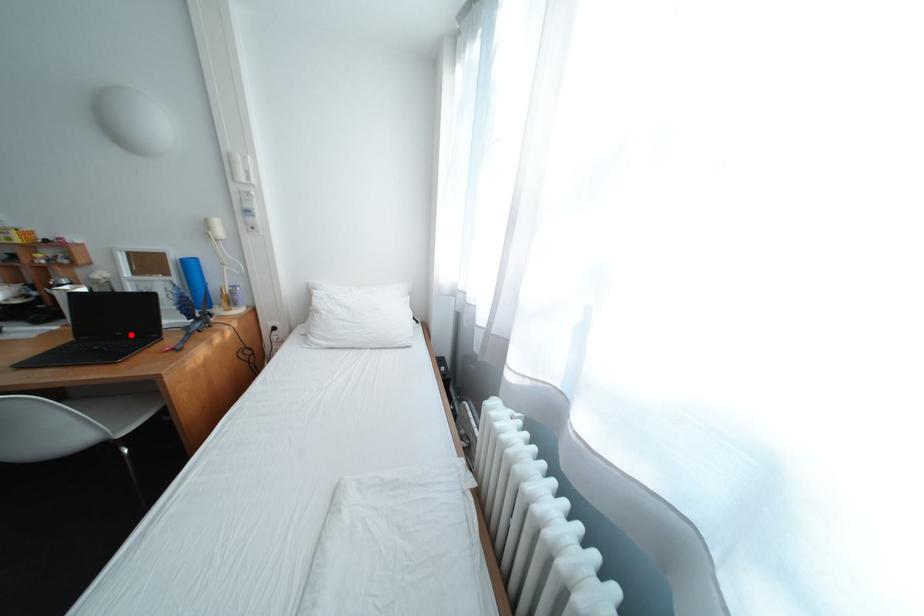
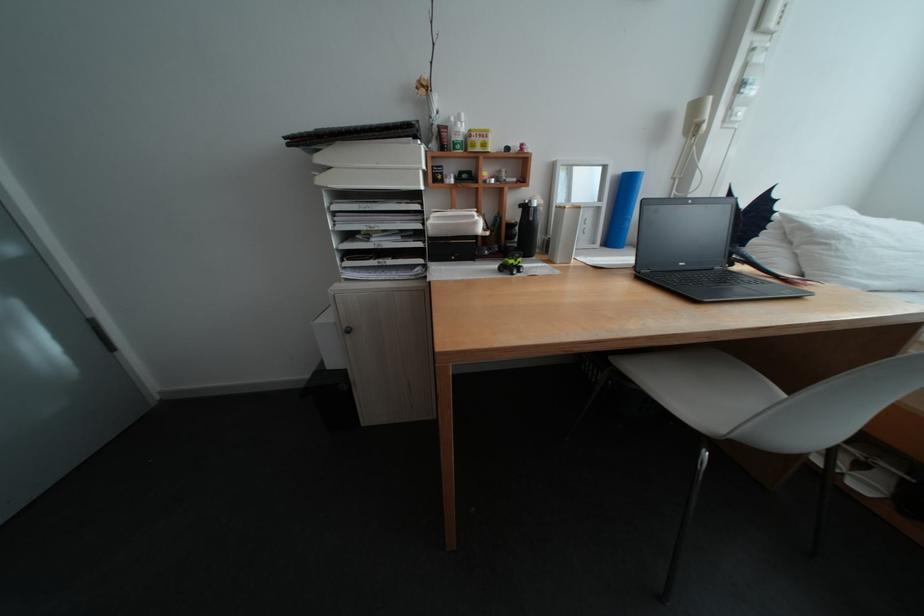
Locate, in the second image, the point that corresponds to the highlighted location in the first image.

(694, 265)